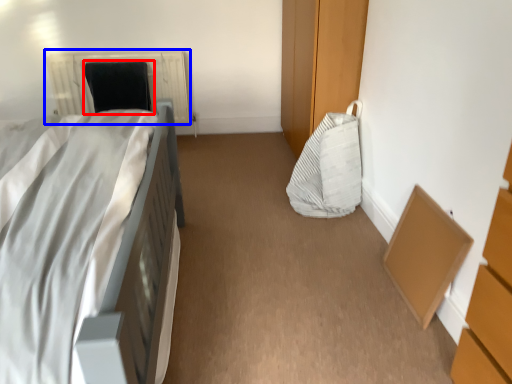
Question: Which of the following is the closest to the observer, bean bag chair (highlighted by a red box) or radiator (highlighted by a blue box)?

Choices:
 (A) bean bag chair
 (B) radiator

Answer: (A)